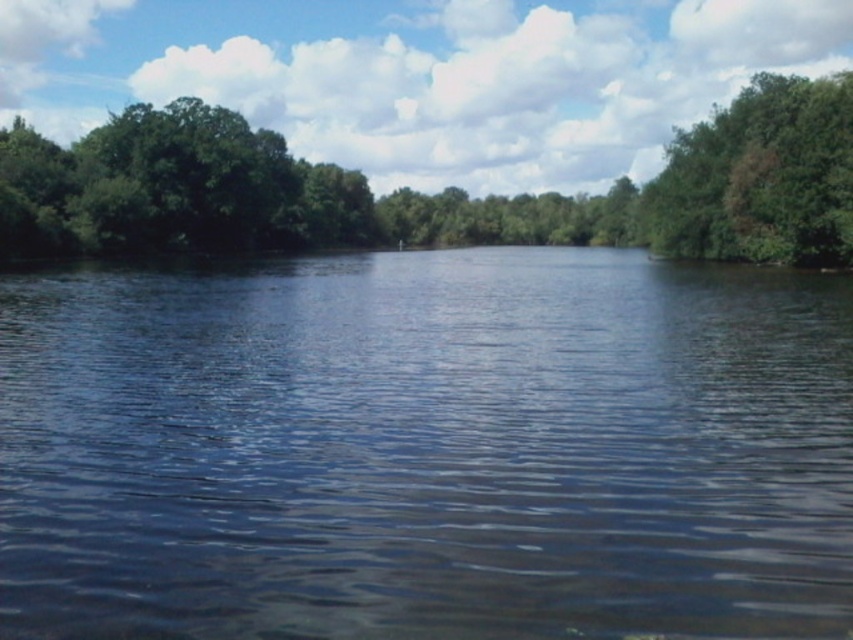
Question: Can you confirm if green leafy trees at left is positioned below green leafy tree at upper right?

Choices:
 (A) no
 (B) yes

Answer: (A)

Question: Considering the real-world distances, which object is closest to the transparent water at center?

Choices:
 (A) green leafy trees at left
 (B) green leafy tree at upper right

Answer: (B)

Question: Does green leafy trees at left have a greater width compared to green leafy tree at upper right?

Choices:
 (A) yes
 (B) no

Answer: (A)

Question: Which object is the closest to the green leafy tree at upper right?

Choices:
 (A) green leafy trees at left
 (B) transparent water at center

Answer: (B)

Question: Does transparent water at center appear under green leafy tree at upper right?

Choices:
 (A) no
 (B) yes

Answer: (B)

Question: Which of the following is the farthest from the observer?

Choices:
 (A) (813, 548)
 (B) (730, 112)
 (C) (24, 227)

Answer: (B)